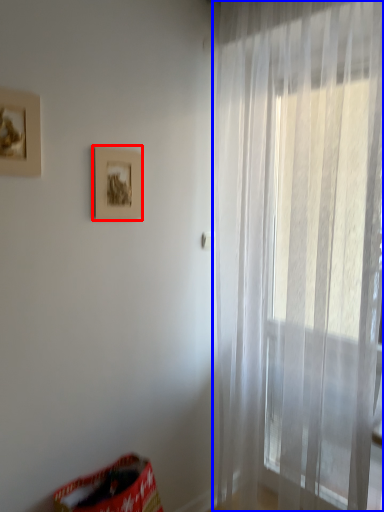
Question: Which of the following is the farthest to the observer, picture frame (highlighted by a red box) or curtain (highlighted by a blue box)?

Choices:
 (A) picture frame
 (B) curtain

Answer: (A)